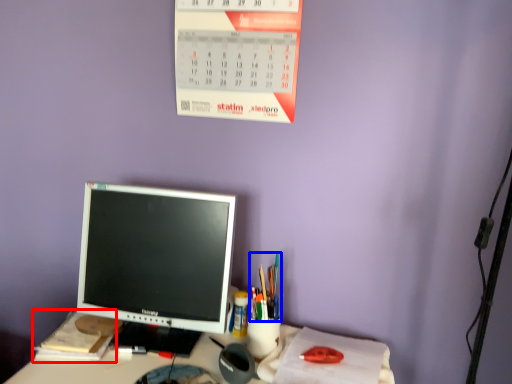
Question: Which of the following is the closest to the observer, notebook (highlighted by a red box) or stationery (highlighted by a blue box)?

Choices:
 (A) notebook
 (B) stationery

Answer: (B)